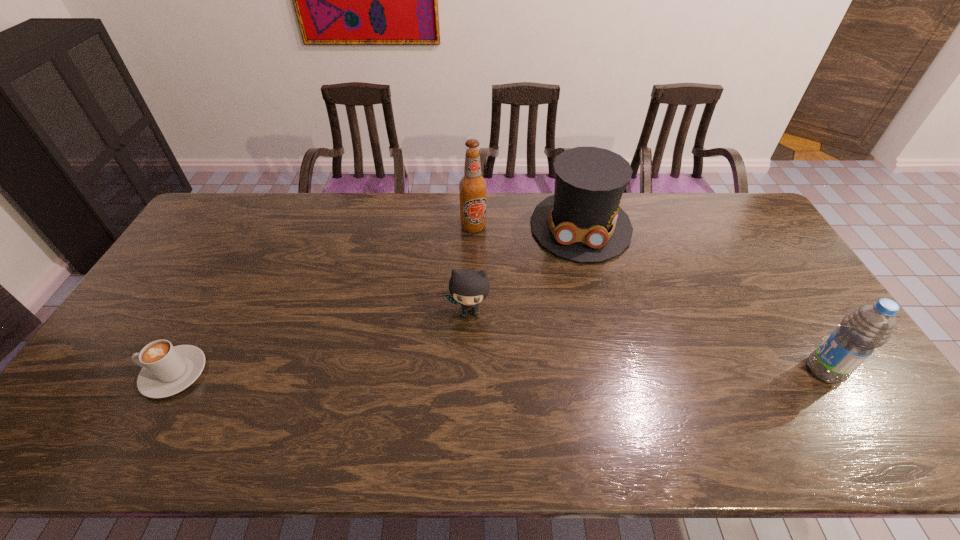
The image size is (960, 540). I want to click on free region located on the front label of the tallest object, so click(485, 320).

Find the location of `vacant area located on the front label of the tallest object`. vacant area located on the front label of the tallest object is located at coordinates (482, 296).

Where is `free spot located with goggles on the front of the dress hat`? free spot located with goggles on the front of the dress hat is located at coordinates (580, 284).

Image resolution: width=960 pixels, height=540 pixels. Find the location of `free spot located 0.230m with goggles on the front of the dress hat`. free spot located 0.230m with goggles on the front of the dress hat is located at coordinates tap(579, 319).

Find the location of a particular element. vacant point located with goggles on the front of the dress hat is located at coordinates (578, 332).

At what (x,y) coordinates should I click in order to perform the action: click on vacant space situated on the front-facing side of the third farthest object. Please return your answer as a coordinate pair (x, y). The height and width of the screenshot is (540, 960). Looking at the image, I should click on (461, 380).

Locate an element on the screen. vacant space located 0.140m on the front-facing side of the third farthest object is located at coordinates pos(463,366).

At what (x,y) coordinates should I click in order to perform the action: click on vacant space located 0.160m on the front-facing side of the third farthest object. Please return your answer as a coordinate pair (x, y). The image size is (960, 540). Looking at the image, I should click on (462, 373).

I want to click on beer bottle that is positioned at the far edge, so click(472, 186).

The image size is (960, 540). I want to click on dress hat at the far edge, so click(582, 221).